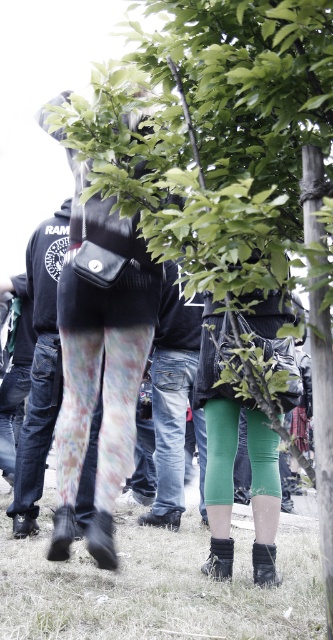
Consider the image. Who is taller, green leafy tree at center or denim jeans at center?

With more height is denim jeans at center.

Is green leafy tree at center wider than denim jeans at center?

Yes.

Is point (179, 33) closer to viewer compared to point (163, 492)?

Yes, point (179, 33) is in front of point (163, 492).

The image size is (333, 640). Find the location of `green leafy tree at center`. green leafy tree at center is located at coordinates (225, 150).

Between floral leggings at center and black suede sock at lower center, which one appears on the right side from the viewer's perspective?

black suede sock at lower center

Can you confirm if floral leggings at center is wider than black suede sock at lower center?

Correct, the width of floral leggings at center exceeds that of black suede sock at lower center.

Where is `floral leggings at center`? floral leggings at center is located at coordinates (39, 369).

Based on the photo, is green leafy tree at center thinner than floral leggings at center?

No.

How much distance is there between green leafy tree at center and floral leggings at center?

green leafy tree at center and floral leggings at center are 2.19 meters apart.

Measure the distance between point (274, 44) and camera.

Point (274, 44) and camera are 6.27 feet apart.

At what (x,y) coordinates should I click in order to perform the action: click on green leafy tree at center. Please return your answer as a coordinate pair (x, y). The image size is (333, 640). Looking at the image, I should click on (225, 150).